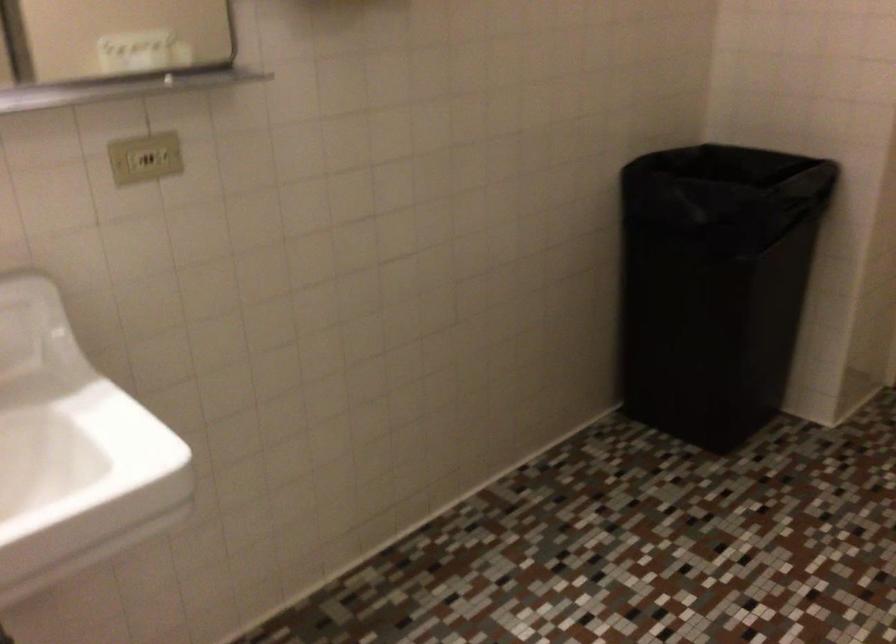
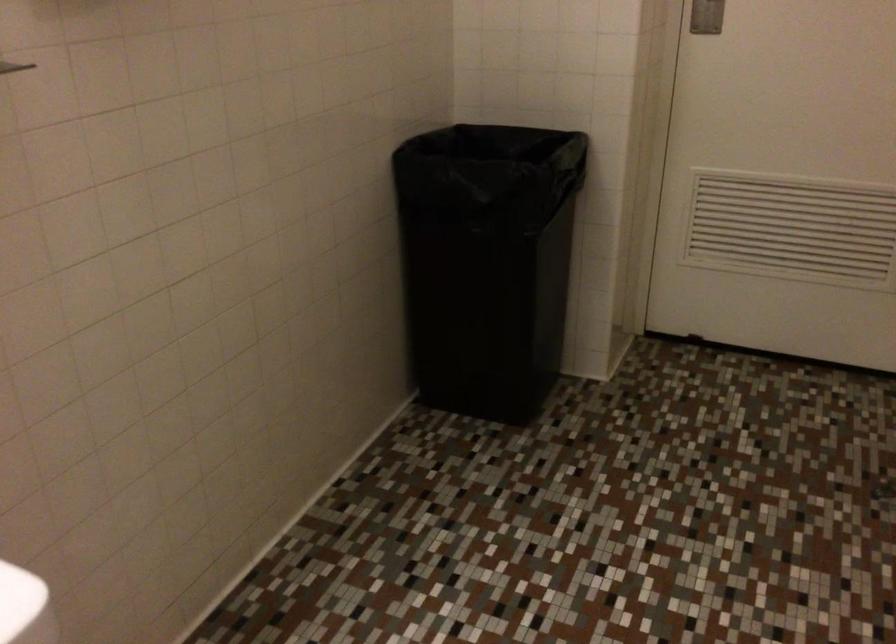
In a continuous first-person perspective shot, in which direction is the camera moving?

The cameraman walked toward left, forward.